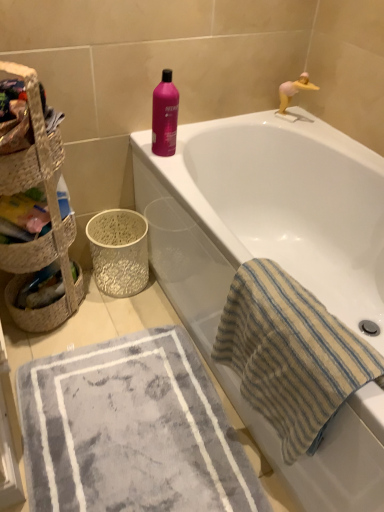
Where is `pink plastic toy at upper right`? The width and height of the screenshot is (384, 512). pink plastic toy at upper right is located at coordinates (294, 90).

What do you see at coordinates (276, 261) in the screenshot? I see `white glossy bathtub at upper center` at bounding box center [276, 261].

Describe the element at coordinates (40, 243) in the screenshot. This screenshot has height=512, width=384. I see `woven straw basket at left, arranged as the 1th basket when viewed from the top` at that location.

Image resolution: width=384 pixels, height=512 pixels. What do you see at coordinates (49, 212) in the screenshot? I see `woven straw basket at left, arranged as the 1th basket when ordered from the bottom` at bounding box center [49, 212].

Measure the distance between woven straw basket at left, positioned as the first basket container in top-to-bottom order, and camera.

They are 1.02 meters apart.

At what (x,y) coordinates should I click in order to perform the action: click on white textured basket at lower left, which is the 1th basket container in back-to-front order. Please return your answer as a coordinate pair (x, y). The image size is (384, 512). Looking at the image, I should click on (119, 251).

Does point (282, 97) come farther from viewer compared to point (166, 106)?

Yes.

Considering the sizes of pink plastic toy at upper right and pink glossy bottle at upper center in the image, is pink plastic toy at upper right bigger or smaller than pink glossy bottle at upper center?

pink plastic toy at upper right is smaller than pink glossy bottle at upper center.

From the picture: Can you tell me how much pink plastic toy at upper right and pink glossy bottle at upper center differ in facing direction?

29.3 degrees.

Can you confirm if pink plastic toy at upper right is thinner than pink glossy bottle at upper center?

Yes.

Can you tell me how much white textured basket at lower left, which is the 1th basket container in back-to-front order, and pink glossy bottle at upper center differ in facing direction?

The facing directions of white textured basket at lower left, which is the 1th basket container in back-to-front order, and pink glossy bottle at upper center are 91 degrees apart.

Could you measure the distance between white textured basket at lower left, acting as the second basket container starting from the front, and pink glossy bottle at upper center?

They are 18.00 inches apart.

Based on the photo, from a real-world perspective, which object rests below the other?

From a 3D spatial view, white textured basket at lower left, acting as the second basket container starting from the front, is below.

Can you confirm if white textured basket at lower left, acting as the second basket container starting from the front, is smaller than pink glossy bottle at upper center?

Actually, white textured basket at lower left, acting as the second basket container starting from the front, might be larger than pink glossy bottle at upper center.

Does woven straw basket at left, arranged as the 1th basket when viewed from the top, have a lesser height compared to gray plush bath mat at lower left?

Incorrect, the height of woven straw basket at left, arranged as the 1th basket when viewed from the top, does not fall short of that of gray plush bath mat at lower left.

Is woven straw basket at left, arranged as the 1th basket when viewed from the top, facing towards gray plush bath mat at lower left?

No, woven straw basket at left, arranged as the 1th basket when viewed from the top, is not oriented towards gray plush bath mat at lower left.

Would you say woven straw basket at left, positioned as the second basket in bottom-to-top order, is outside gray plush bath mat at lower left?

Absolutely, woven straw basket at left, positioned as the second basket in bottom-to-top order, is external to gray plush bath mat at lower left.

Is woven straw basket at left, arranged as the 1th basket when viewed from the top, far from gray plush bath mat at lower left?

No.

Considering the relative positions of white glossy bathtub at upper center and pink plastic toy at upper right in the image provided, is white glossy bathtub at upper center behind pink plastic toy at upper right?

No, white glossy bathtub at upper center is in front of pink plastic toy at upper right.

Is white glossy bathtub at upper center thinner than pink plastic toy at upper right?

In fact, white glossy bathtub at upper center might be wider than pink plastic toy at upper right.

From the image's perspective, is woven straw basket at left, the second basket viewed from the top, on gray plush bath mat at lower left?

Yes.

At what (x,y) coordinates should I click in order to perform the action: click on basket that is the 1st object to the left of the gray plush bath mat at lower left, starting at the anchor. Please return your answer as a coordinate pair (x, y). Looking at the image, I should click on (49, 212).

Does woven straw basket at left, the second basket viewed from the top, have a larger size compared to gray plush bath mat at lower left?

Yes.

Does point (36, 128) appear closer or farther from the camera than point (138, 289)?

Point (36, 128) is closer to the camera than point (138, 289).

Could you measure the distance between woven straw basket at left, arranged as the 1th basket when ordered from the bottom, and white textured basket at lower left, the 2th basket container in the top-to-bottom sequence?

The distance of woven straw basket at left, arranged as the 1th basket when ordered from the bottom, from white textured basket at lower left, the 2th basket container in the top-to-bottom sequence, is 9.81 inches.

Would you say woven straw basket at left, the second basket viewed from the top, is inside or outside white textured basket at lower left, the 2th basket container in the top-to-bottom sequence?

woven straw basket at left, the second basket viewed from the top, is not enclosed by white textured basket at lower left, the 2th basket container in the top-to-bottom sequence.

Who is taller, white glossy bathtub at upper center or woven straw basket at left, arranged as the 1th basket container when viewed from the front?

white glossy bathtub at upper center.

Does white glossy bathtub at upper center have a lesser width compared to woven straw basket at left, arranged as the 1th basket container when viewed from the front?

No, white glossy bathtub at upper center is not thinner than woven straw basket at left, arranged as the 1th basket container when viewed from the front.

Does white glossy bathtub at upper center touch woven straw basket at left, positioned as the first basket container in top-to-bottom order?

No, white glossy bathtub at upper center is not next to woven straw basket at left, positioned as the first basket container in top-to-bottom order.

Identify the location of cleaning product on the left of pink plastic toy at upper right. (165, 116).

Locate an element on the screen. This screenshot has height=512, width=384. cleaning product on the right of white textured basket at lower left, which is the 1th basket container in back-to-front order is located at coordinates (165, 116).

Considering their positions, is beige striped towel at right positioned closer to woven straw basket at left, the second basket viewed from the top, than white glossy bathtub at upper center?

Among the two, white glossy bathtub at upper center is located nearer to woven straw basket at left, the second basket viewed from the top.

When comparing their distances from pink glossy bottle at upper center, does woven straw basket at left, the second basket viewed from the top, or white textured basket at lower left, acting as the second basket container starting from the front, seem further?

white textured basket at lower left, acting as the second basket container starting from the front, is further to pink glossy bottle at upper center.

Considering their positions, is woven straw basket at left, arranged as the 1th basket container when viewed from the front, positioned closer to woven straw basket at left, positioned as the second basket in bottom-to-top order, than pink glossy bottle at upper center?

woven straw basket at left, arranged as the 1th basket container when viewed from the front, lies closer to woven straw basket at left, positioned as the second basket in bottom-to-top order, than the other object.

Which object lies further to the anchor point gray plush bath mat at lower left, woven straw basket at left, positioned as the second basket container in bottom-to-top order, or white textured basket at lower left, acting as the second basket container starting from the front?

woven straw basket at left, positioned as the second basket container in bottom-to-top order.

From the image, which object appears to be farther from white glossy bathtub at upper center, beige striped towel at right or white textured basket at lower left, the 2th basket container in the top-to-bottom sequence?

white textured basket at lower left, the 2th basket container in the top-to-bottom sequence, is positioned further to the anchor white glossy bathtub at upper center.

Based on the photo, when comparing their distances from woven straw basket at left, the second basket viewed from the top, does woven straw basket at left, arranged as the 1th basket when viewed from the top, or beige striped towel at right seem further?

The object further to woven straw basket at left, the second basket viewed from the top, is beige striped towel at right.

Consider the image. From the image, which object appears to be nearer to gray plush bath mat at lower left, beige striped towel at right or white glossy bathtub at upper center?

beige striped towel at right is positioned closer to the anchor gray plush bath mat at lower left.

Which object lies nearer to the anchor point gray plush bath mat at lower left, woven straw basket at left, arranged as the 1th basket when viewed from the top, or beige striped towel at right?

beige striped towel at right is closer to gray plush bath mat at lower left.

This screenshot has width=384, height=512. Find the location of `beach towel positioned between white glossy bathtub at upper center and pink plastic toy at upper right from near to far`. beach towel positioned between white glossy bathtub at upper center and pink plastic toy at upper right from near to far is located at coordinates (290, 355).

At what (x,y) coordinates should I click in order to perform the action: click on basket container between woven straw basket at left, arranged as the 1th basket when ordered from the bottom, and white textured basket at lower left, which is the 1th basket container in back-to-front order, from front to back. Please return your answer as a coordinate pair (x, y). Looking at the image, I should click on click(x=41, y=138).

Locate an element on the screen. bathtub between pink glossy bottle at upper center and beige striped towel at right from top to bottom is located at coordinates (276, 261).

Locate an element on the screen. The height and width of the screenshot is (512, 384). cleaning product positioned between woven straw basket at left, the second basket viewed from the top, and white textured basket at lower left, which appears as the first basket container when ordered from the bottom, from near to far is located at coordinates (165, 116).